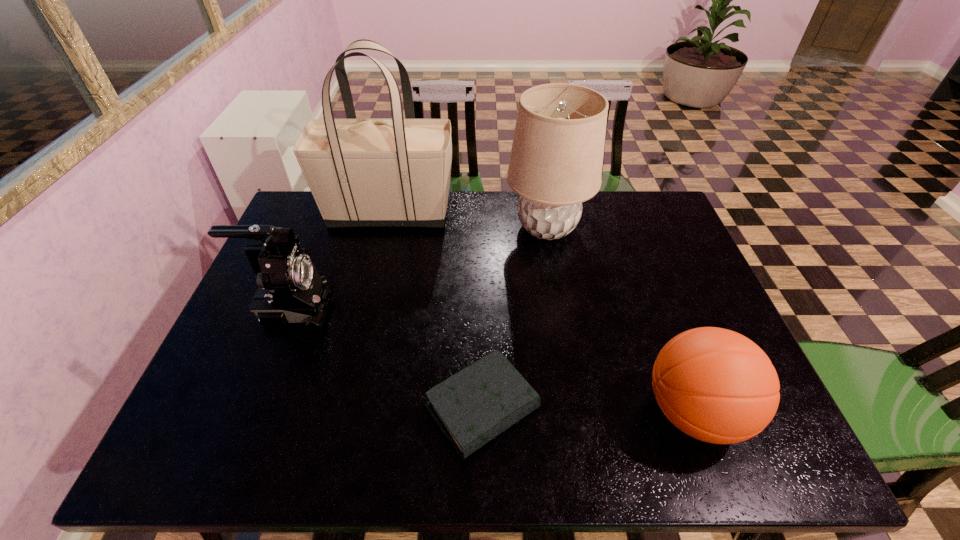
At what (x,y) coordinates should I click in order to perform the action: click on free space between the shopping bag and the shortest object. Please return your answer as a coordinate pair (x, y). Looking at the image, I should click on (436, 310).

Find the location of a particular element. This screenshot has width=960, height=540. vacant space that's between the shopping bag and the rightmost object is located at coordinates (541, 312).

Locate which object ranks fourth in proximity to the shortest object. Please provide its 2D coordinates. Your answer should be formatted as a tuple, i.e. [(x, y)], where the tuple contains the x and y coordinates of a point satisfying the conditions above.

[(395, 172)]

Identify the location of object that ranks as the second closest to the rightmost object. (556, 160).

Where is `free spot that satisfies the following two spatial constraints: 1. on the back side of the basketball; 2. with handles facing forward on the tallest object`? The image size is (960, 540). free spot that satisfies the following two spatial constraints: 1. on the back side of the basketball; 2. with handles facing forward on the tallest object is located at coordinates (620, 212).

The width and height of the screenshot is (960, 540). Identify the location of vacant space that satisfies the following two spatial constraints: 1. with handles facing forward on the Bible; 2. on the left side of the tallest object. (342, 408).

Locate an element on the screen. free space in the image that satisfies the following two spatial constraints: 1. on the back side of the rightmost object; 2. on the lens mount of the camcorder is located at coordinates (655, 307).

At what (x,y) coordinates should I click in order to perform the action: click on vacant space that satisfies the following two spatial constraints: 1. on the lens mount of the shortest object; 2. on the right side of the camcorder. Please return your answer as a coordinate pair (x, y). Looking at the image, I should click on (252, 408).

The width and height of the screenshot is (960, 540). What are the coordinates of `free location that satisfies the following two spatial constraints: 1. on the lens mount of the camcorder; 2. on the left side of the shortest object` in the screenshot? It's located at (252, 408).

Locate an element on the screen. This screenshot has height=540, width=960. free space that satisfies the following two spatial constraints: 1. on the back side of the second tallest object; 2. with handles facing forward on the tallest object is located at coordinates pos(544,212).